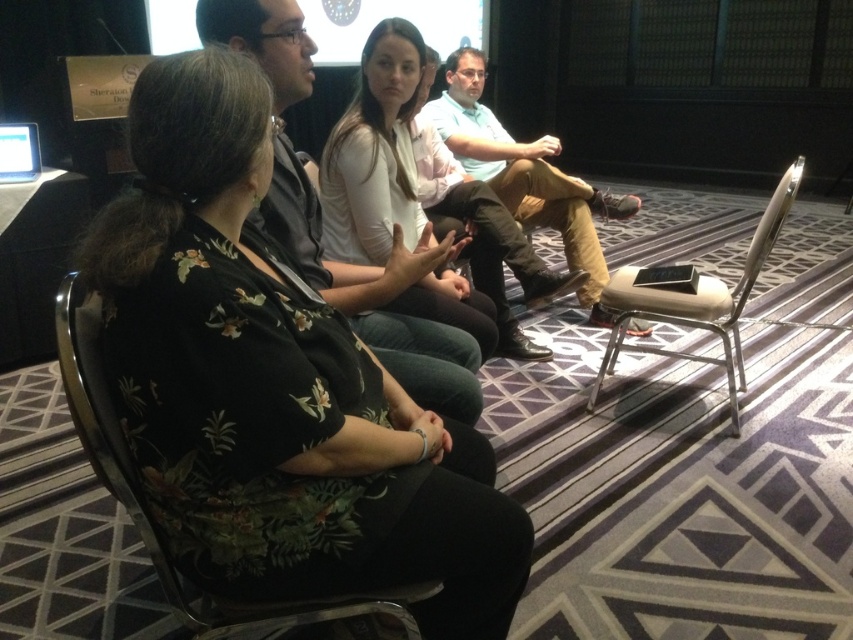
From the picture: Who is positioned more to the left, metallic silver chair at right or matte white screen at upper center?

Positioned to the left is matte white screen at upper center.

Locate an element on the screen. metallic silver chair at right is located at coordinates tap(695, 298).

Describe the element at coordinates (695, 298) in the screenshot. I see `metallic silver chair at right` at that location.

Identify the location of metallic silver chair at right. Image resolution: width=853 pixels, height=640 pixels. (695, 298).

What do you see at coordinates (525, 173) in the screenshot? I see `light blue cotton shirt at center` at bounding box center [525, 173].

The width and height of the screenshot is (853, 640). In order to click on light blue cotton shirt at center in this screenshot , I will do `click(525, 173)`.

Which is behind, point (433, 385) or point (387, 40)?

Point (387, 40)

The width and height of the screenshot is (853, 640). What are the coordinates of `matte black shirt at center` in the screenshot? It's located at (376, 296).